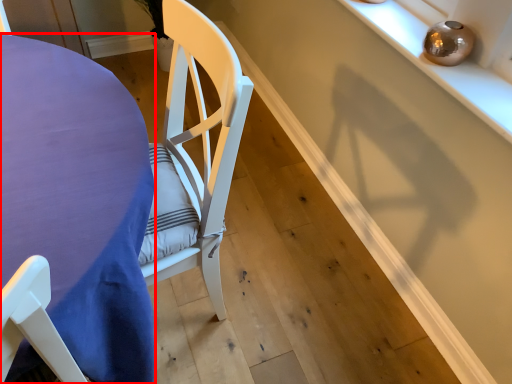
Question: From the image's perspective, where is table (annotated by the red box) located in relation to shelf in the image?

Choices:
 (A) below
 (B) above

Answer: (A)